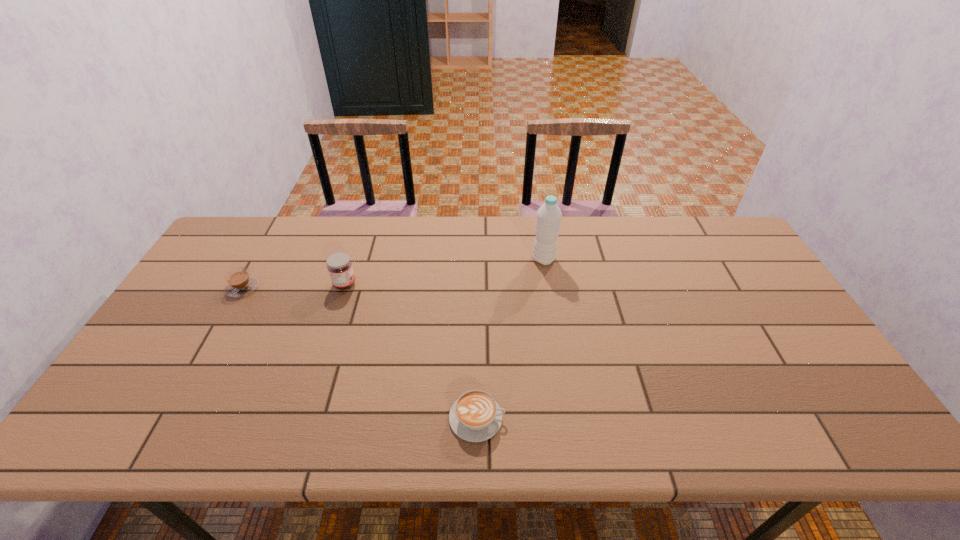
Image resolution: width=960 pixels, height=540 pixels. I want to click on the tallest object, so click(x=548, y=220).

Where is `the farthest object`? the farthest object is located at coordinates (548, 220).

Locate an element on the screen. The image size is (960, 540). jam is located at coordinates (339, 265).

Locate an element on the screen. the third shortest object is located at coordinates (339, 265).

Locate an element on the screen. The image size is (960, 540). the second shortest object is located at coordinates (239, 283).

The width and height of the screenshot is (960, 540). I want to click on the left cappuccino, so click(239, 283).

What are the coordinates of `the nearer cappuccino` in the screenshot? It's located at (475, 416).

Image resolution: width=960 pixels, height=540 pixels. What are the coordinates of `the right cappuccino` in the screenshot? It's located at (475, 416).

Locate an element on the screen. The image size is (960, 540). blank space located 0.180m on the right of the tallest object is located at coordinates (612, 259).

Find the location of a particular element. The width and height of the screenshot is (960, 540). vacant space located 0.140m on the back of the jam is located at coordinates (356, 248).